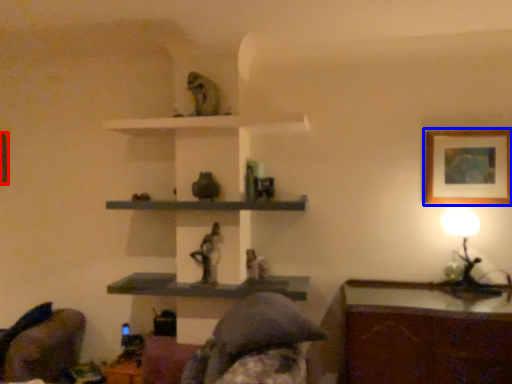
Question: Which object appears farthest to the camera in this image, picture frame (highlighted by a red box) or picture frame (highlighted by a blue box)?

Choices:
 (A) picture frame
 (B) picture frame

Answer: (A)